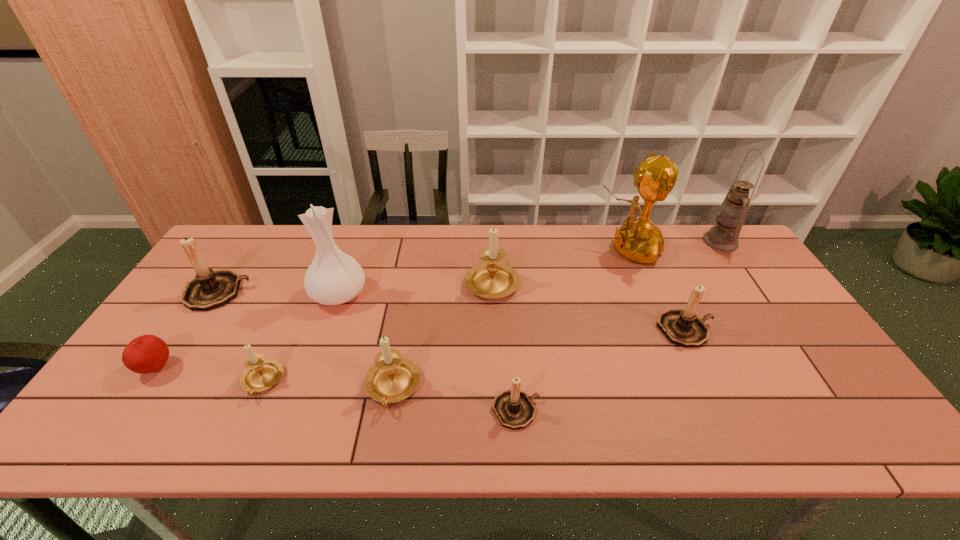
In order to click on the second smallest brown candle holder in this screenshot , I will do `click(682, 327)`.

Identify the location of the second biggest beige candle holder. (393, 378).

You are a GUI agent. You are given a task and a screenshot of the screen. Output one action in this format:
    pyautogui.click(x=<x>, y=<y>)
    Task: Click on the fourth candle holder from right to left
    
    Given the screenshot: What is the action you would take?
    pyautogui.click(x=393, y=378)

This screenshot has width=960, height=540. What are the coordinates of `the smallest beige candle holder` in the screenshot? It's located at (260, 374).

Where is `the fifth candle holder from right to left`? This screenshot has height=540, width=960. the fifth candle holder from right to left is located at coordinates (260, 374).

The width and height of the screenshot is (960, 540). I want to click on the smallest brown candle holder, so (x=514, y=409).

Identify the location of the nearest brown candle holder. (514, 409).

Identify the location of apple. (145, 354).

The width and height of the screenshot is (960, 540). In order to click on the shortest object in this screenshot , I will do [x=145, y=354].

You are a GUI agent. You are given a task and a screenshot of the screen. Output one action in this format:
    pyautogui.click(x=<x>, y=<y>)
    Task: Click on the vacant space located on the front side of the award
    The height and width of the screenshot is (540, 960).
    Given the screenshot: What is the action you would take?
    pyautogui.click(x=505, y=249)